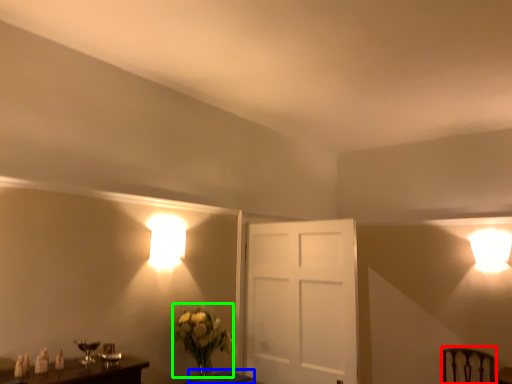
Question: Based on their relative distances, which object is farther from swivel chair (highlighted by a red box)? Choose from table (highlighted by a blue box) and floral arrangement (highlighted by a green box).

Choices:
 (A) table
 (B) floral arrangement

Answer: (B)